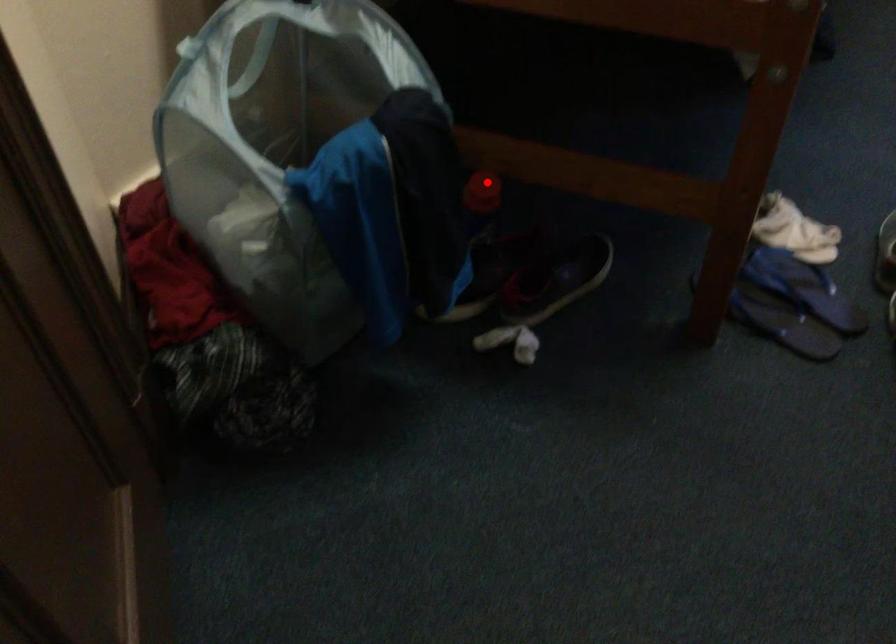
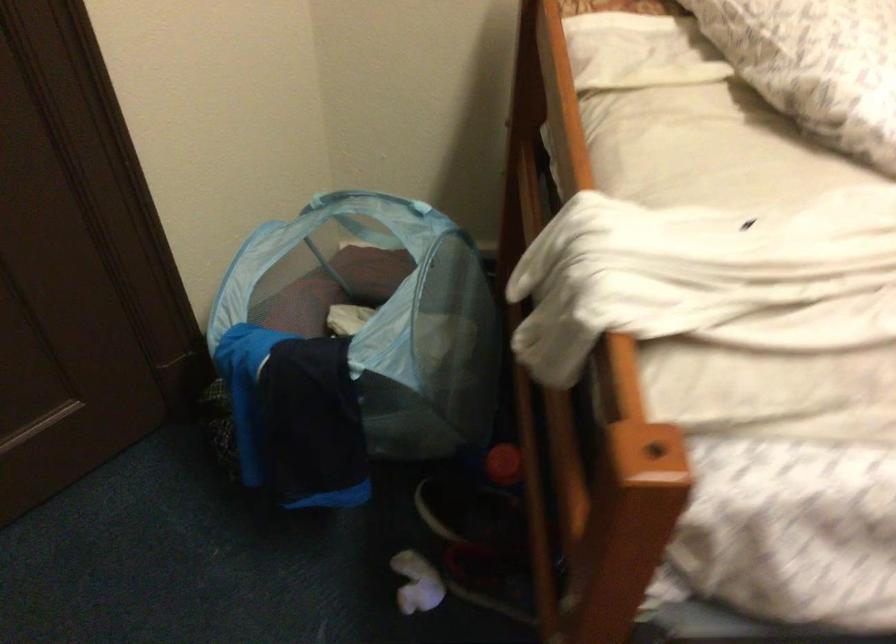
In the second image, find the point that corresponds to the highlighted location in the first image.

(504, 464)